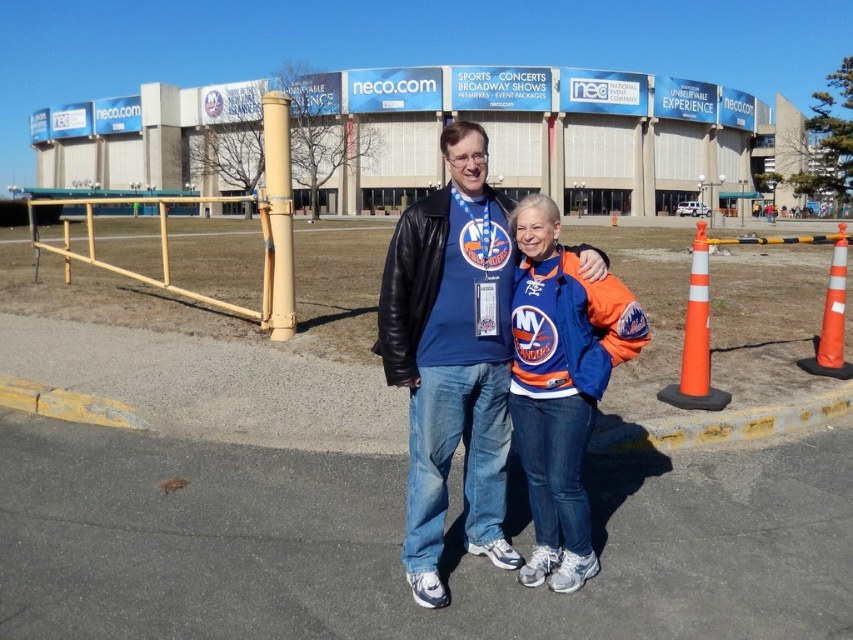
Question: Is blue jersey at center to the left of orange/reflective traffic cone at right from the viewer's perspective?

Choices:
 (A) no
 (B) yes

Answer: (B)

Question: Which object is positioned closest to the orange/cone at right?

Choices:
 (A) orange/reflective traffic cone at right
 (B) blue fleece jacket at center
 (C) blue jersey at center

Answer: (B)

Question: Can you confirm if blue fleece jacket at center is bigger than orange/cone at right?

Choices:
 (A) no
 (B) yes

Answer: (A)

Question: Estimate the real-world distances between objects in this image. Which object is closer to the orange/cone at right?

Choices:
 (A) blue fleece jacket at center
 (B) orange/reflective traffic cone at right

Answer: (A)

Question: Which of the following is the closest to the observer?

Choices:
 (A) (556, 563)
 (B) (701, 312)
 (C) (827, 365)
 (D) (460, 353)

Answer: (D)

Question: Can you confirm if blue jersey at center is bigger than orange/reflective traffic cone at right?

Choices:
 (A) no
 (B) yes

Answer: (A)